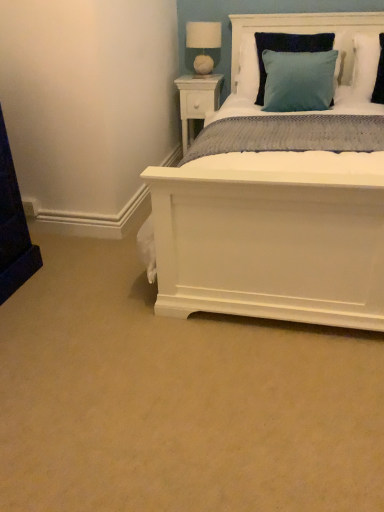
Question: Is teal fabric pillow at upper right, positioned as the first pillow in right-to-left order, bigger than teal velvet pillow at upper right, placed as the second pillow when sorted from right to left?

Choices:
 (A) no
 (B) yes

Answer: (A)

Question: From the image's perspective, is teal fabric pillow at upper right, positioned as the first pillow in right-to-left order, below teal velvet pillow at upper right, placed as the second pillow when sorted from right to left?

Choices:
 (A) no
 (B) yes

Answer: (A)

Question: Is teal fabric pillow at upper right, placed as the 2th pillow when sorted from left to right, behind teal velvet pillow at upper right, placed as the second pillow when sorted from right to left?

Choices:
 (A) yes
 (B) no

Answer: (A)

Question: Does teal fabric pillow at upper right, placed as the 2th pillow when sorted from left to right, turn towards teal velvet pillow at upper right, which appears as the 1th pillow when viewed from the left?

Choices:
 (A) no
 (B) yes

Answer: (A)

Question: From a real-world perspective, is teal fabric pillow at upper right, positioned as the first pillow in right-to-left order, positioned under teal velvet pillow at upper right, placed as the second pillow when sorted from right to left, based on gravity?

Choices:
 (A) no
 (B) yes

Answer: (A)

Question: Considering their positions, is white fabric-covered lampshade at upper center located in front of or behind teal velvet pillow at upper right, which appears as the 1th pillow when viewed from the left?

Choices:
 (A) front
 (B) behind

Answer: (B)

Question: Choose the correct answer: Is white fabric-covered lampshade at upper center inside teal velvet pillow at upper right, placed as the second pillow when sorted from right to left, or outside it?

Choices:
 (A) outside
 (B) inside

Answer: (A)

Question: From the image's perspective, is white fabric-covered lampshade at upper center positioned above or below teal velvet pillow at upper right, which appears as the 1th pillow when viewed from the left?

Choices:
 (A) above
 (B) below

Answer: (A)

Question: Visually, is white fabric-covered lampshade at upper center positioned to the left or to the right of teal velvet pillow at upper right, which appears as the 1th pillow when viewed from the left?

Choices:
 (A) right
 (B) left

Answer: (B)

Question: Is white fabric-covered lampshade at upper center wider or thinner than white wood nightstand at upper center?

Choices:
 (A) wide
 (B) thin

Answer: (B)

Question: Relative to white wood nightstand at upper center, is white fabric-covered lampshade at upper center in front or behind?

Choices:
 (A) behind
 (B) front

Answer: (B)

Question: From a real-world perspective, relative to white wood nightstand at upper center, is white fabric-covered lampshade at upper center vertically above or below?

Choices:
 (A) below
 (B) above

Answer: (B)

Question: In terms of height, does white fabric-covered lampshade at upper center look taller or shorter compared to white wood nightstand at upper center?

Choices:
 (A) short
 (B) tall

Answer: (A)

Question: Visually, is teal fabric pillow at upper right, placed as the 2th pillow when sorted from left to right, positioned to the left or to the right of white wood headboard at upper center?

Choices:
 (A) left
 (B) right

Answer: (B)

Question: From the image's perspective, relative to white wood headboard at upper center, is teal fabric pillow at upper right, positioned as the first pillow in right-to-left order, above or below?

Choices:
 (A) below
 (B) above

Answer: (A)